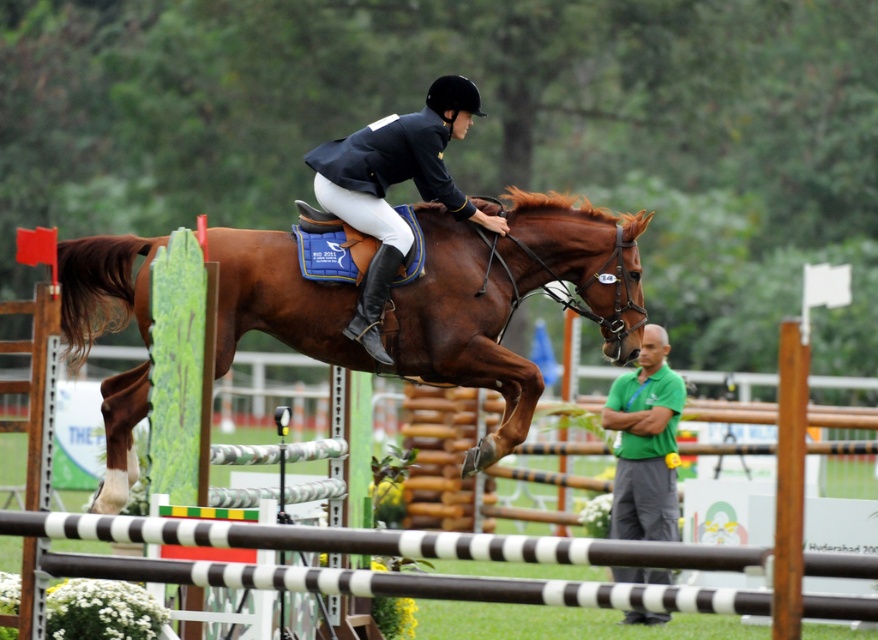
Which is more to the left, shiny navy blue jacket at center or green fabric shirt at lower right?

Positioned to the left is shiny navy blue jacket at center.

Can you confirm if shiny navy blue jacket at center is smaller than green fabric shirt at lower right?

Yes, shiny navy blue jacket at center is smaller than green fabric shirt at lower right.

Identify the location of shiny navy blue jacket at center. The height and width of the screenshot is (640, 878). (393, 182).

Can you confirm if brown glossy horse at center is positioned above shiny navy blue jacket at center?

Incorrect, brown glossy horse at center is not positioned above shiny navy blue jacket at center.

Does point (571, 196) lie in front of point (407, 234)?

That is False.

This screenshot has height=640, width=878. Find the location of `brown glossy horse at center`. brown glossy horse at center is located at coordinates (512, 298).

Is brown glossy horse at center to the left of green fabric shirt at lower right from the viewer's perspective?

Yes, brown glossy horse at center is to the left of green fabric shirt at lower right.

Looking at this image, can you confirm if brown glossy horse at center is taller than green fabric shirt at lower right?

No, brown glossy horse at center is not taller than green fabric shirt at lower right.

Locate an element on the screen. Image resolution: width=878 pixels, height=640 pixels. brown glossy horse at center is located at coordinates pos(512,298).